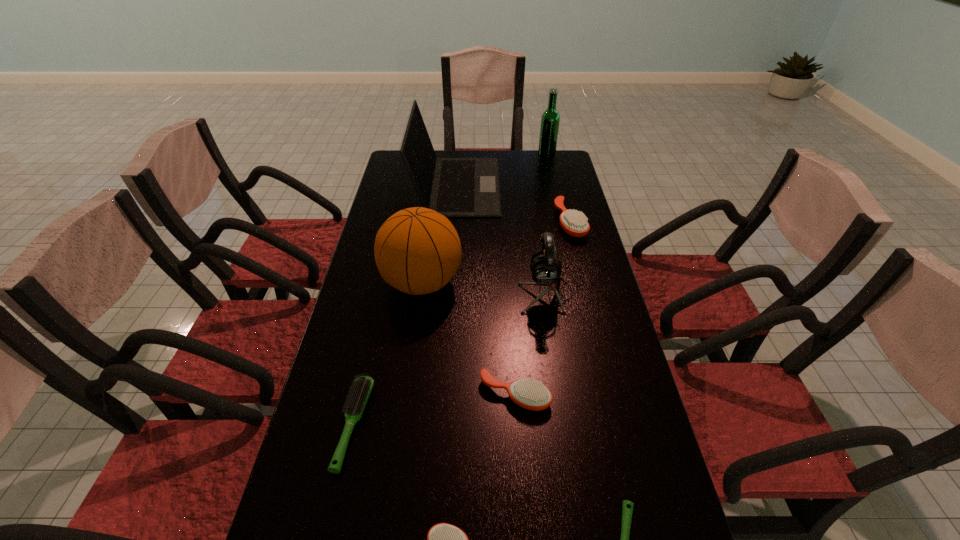
Find the location of a particular element. the farthest object is located at coordinates (550, 119).

The width and height of the screenshot is (960, 540). Find the location of `beer bottle`. beer bottle is located at coordinates (550, 119).

The height and width of the screenshot is (540, 960). I want to click on laptop, so click(x=455, y=187).

What are the coordinates of `orange basketball` in the screenshot? It's located at (417, 250).

The height and width of the screenshot is (540, 960). Identify the location of earphone. (546, 270).

Where is `the rightmost orange hairbrush`? the rightmost orange hairbrush is located at coordinates (574, 223).

Locate an element on the screen. This screenshot has width=960, height=540. the biggest orange hairbrush is located at coordinates (574, 223).

You are a GUI agent. You are given a task and a screenshot of the screen. Output one action in this format:
    pyautogui.click(x=<x>, y=<y>)
    Task: Click on the second nearest orange hairbrush
    Image resolution: width=960 pixels, height=540 pixels.
    Given the screenshot: What is the action you would take?
    pyautogui.click(x=532, y=395)

Identify the location of the fourth shortest hairbrush. (532, 395).

The width and height of the screenshot is (960, 540). In order to click on the left light hairbrush in this screenshot , I will do `click(361, 389)`.